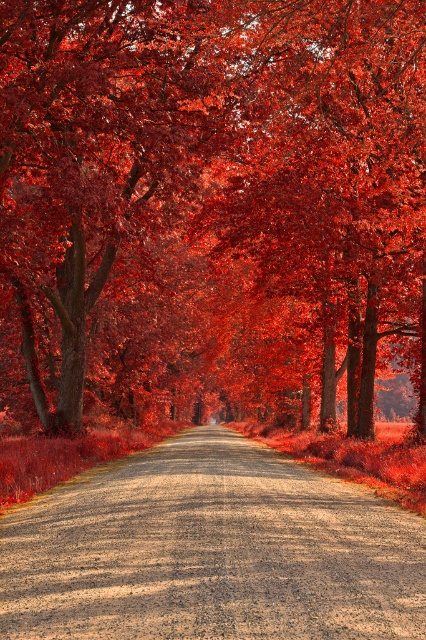
Looking at this image, you are standing at the point marked by the coordinates point (210, 209) in the gravel road scene. What type of tree are you closest to?

The point (210, 209) indicates a smooth bark tree at center, so you are closest to the smooth bark tree at center.